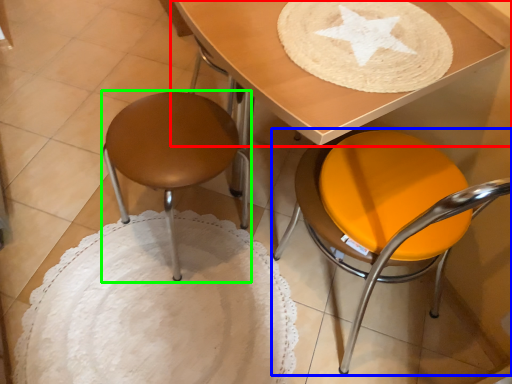
Question: Which is nearer to the table (highlighted by a red box)? chair (highlighted by a blue box) or stool (highlighted by a green box).

Choices:
 (A) chair
 (B) stool

Answer: (A)